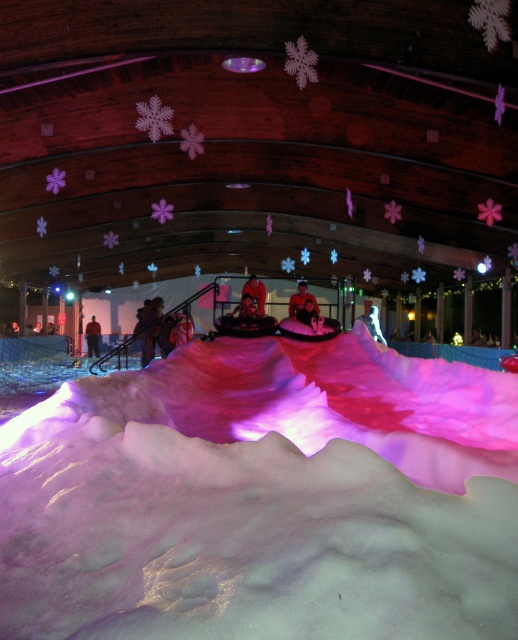
You are standing in the indoor snow play area and want to take a photo that includes both the point at coordinates point[255,291] and point[85,332]. Which point should you position closer to the camera to ensure both are in focus?

A: To ensure both points are in focus, position the camera closer to point[255,291] since it is already closer to the camera than point[85,332]. This way, the depth of field will cover both points effectively.